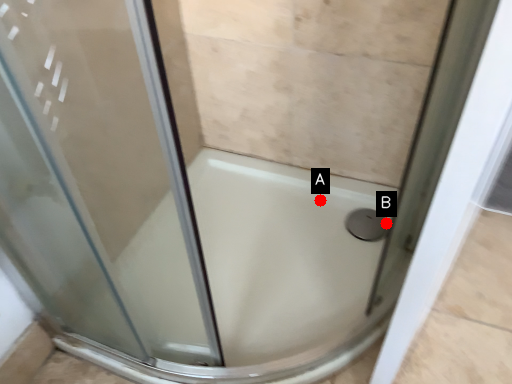
Question: Two points are circled on the image, labeled by A and B beside each circle. Which point appears farthest from the camera in this image?

Choices:
 (A) A is further
 (B) B is further

Answer: (A)